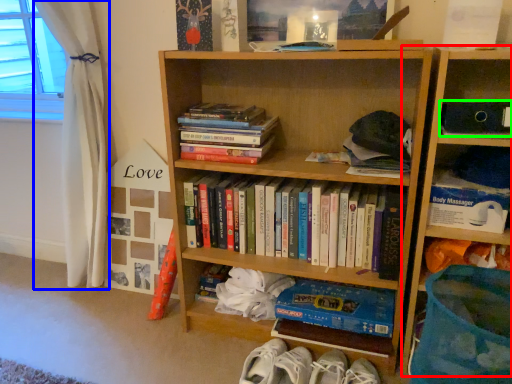
Question: Based on their relative distances, which object is farther from bookcase (highlighted by a red box)? Choose from curtain (highlighted by a blue box) and paperback book (highlighted by a green box).

Choices:
 (A) curtain
 (B) paperback book

Answer: (A)